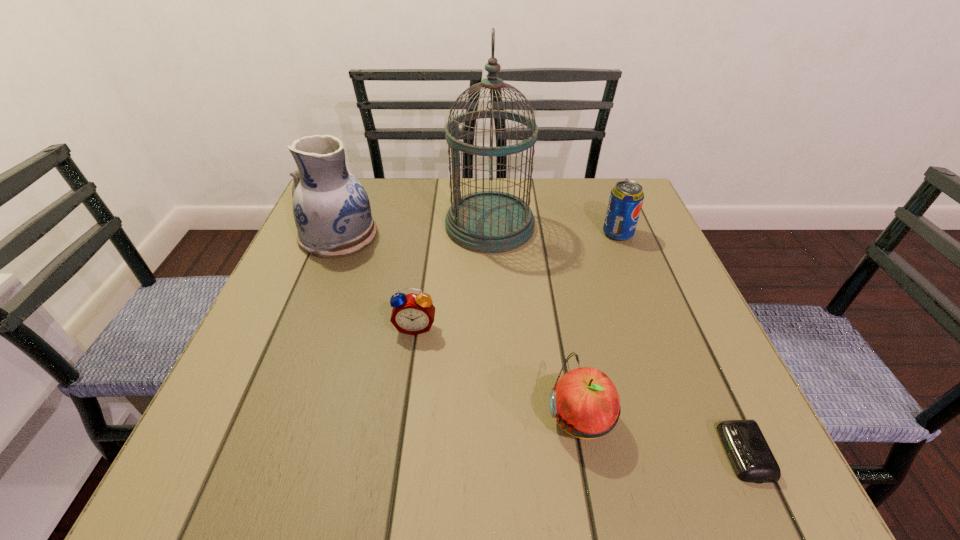
This screenshot has height=540, width=960. In order to click on vacant space that satisfies the following two spatial constraints: 1. on the front-facing side of the tallest object; 2. on the front-facing side of the third nearest object in this screenshot , I will do `click(492, 327)`.

At what (x,y) coordinates should I click in order to perform the action: click on free space that satisfies the following two spatial constraints: 1. on the back side of the soda; 2. on the left side of the apple. Please return your answer as a coordinate pair (x, y). The width and height of the screenshot is (960, 540). Looking at the image, I should click on (545, 234).